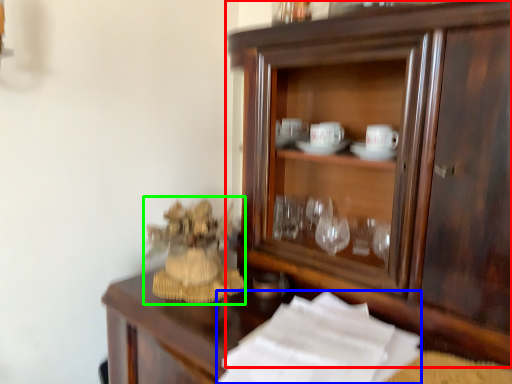
Question: Which object is positioned farthest from cupboard (highlighted by a red box)? Select from paper (highlighted by a blue box) and toy (highlighted by a green box).

Choices:
 (A) paper
 (B) toy

Answer: (B)